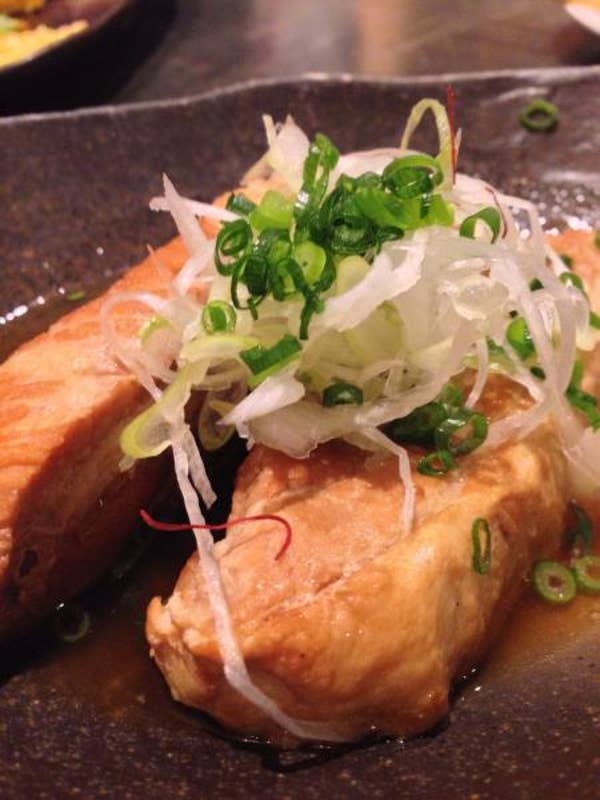
Locate an element on the screen. plate is located at coordinates (477, 740).